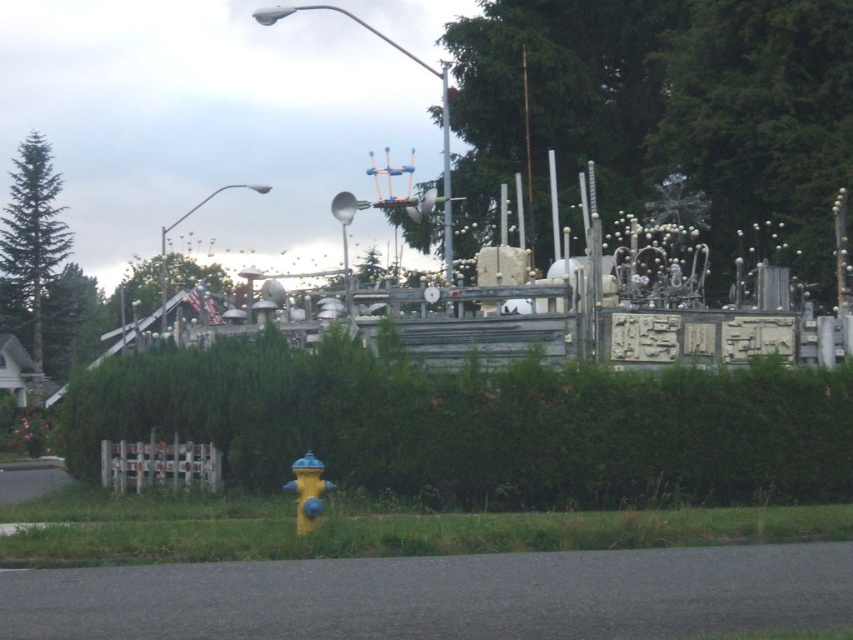
You are standing at the point marked as point (479, 426) in the image. What object is directly in front of you?

The point (479, 426) corresponds to the green leafy hedge at center, so the object directly in front of you is the green leafy hedge at center.

You are a gardener assessing the landscape. You need to determine the spatial relationship between the green leafy hedge at center and the green matte tree at left. Based on the scene, which object is positioned lower in the image?

The green leafy hedge at center is positioned below the green matte tree at left, so it is lower in the image.